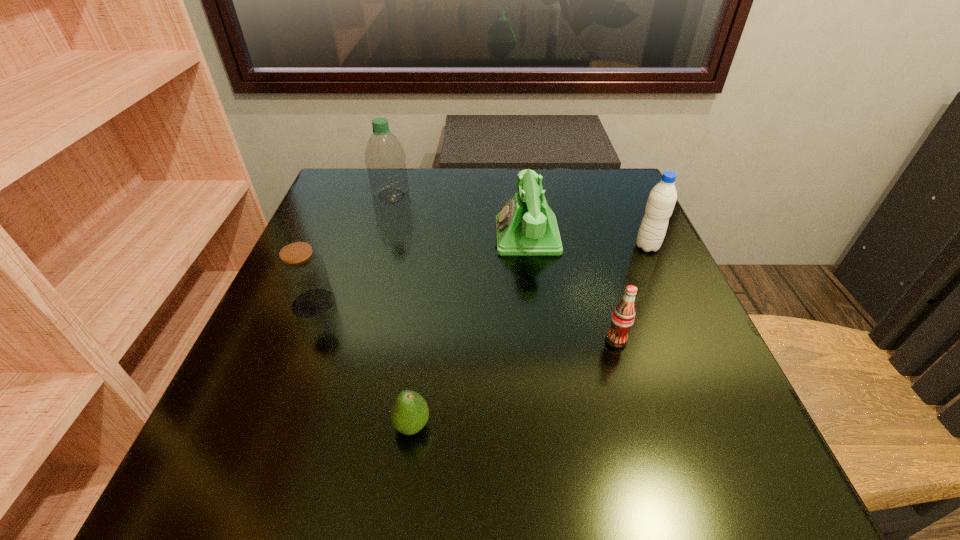
Locate an element on the screen. This screenshot has width=960, height=540. vacant space at the near right corner is located at coordinates (770, 492).

This screenshot has height=540, width=960. What are the coordinates of `free space between the leftmost object and the second object from right to left` in the screenshot? It's located at (465, 322).

I want to click on vacant point located between the second nearest object and the leftmost object, so click(x=465, y=322).

Locate an element on the screen. free space between the fourth object from left to right and the third nearest object is located at coordinates (420, 269).

I want to click on vacant space that is in between the leftmost object and the fifth object from right to left, so click(x=352, y=249).

The height and width of the screenshot is (540, 960). I want to click on vacant area between the soda and the fourth farthest object, so click(465, 322).

What are the coordinates of `empty location between the jar and the telephone` in the screenshot? It's located at (420, 269).

In order to click on free point between the soda and the left water bottle in this screenshot , I will do `click(504, 268)`.

Identify the location of free area in between the third nearest object and the telephone. (420, 269).

Locate an element on the screen. The image size is (960, 540). the second closest object relative to the fourth object from right to left is located at coordinates (622, 319).